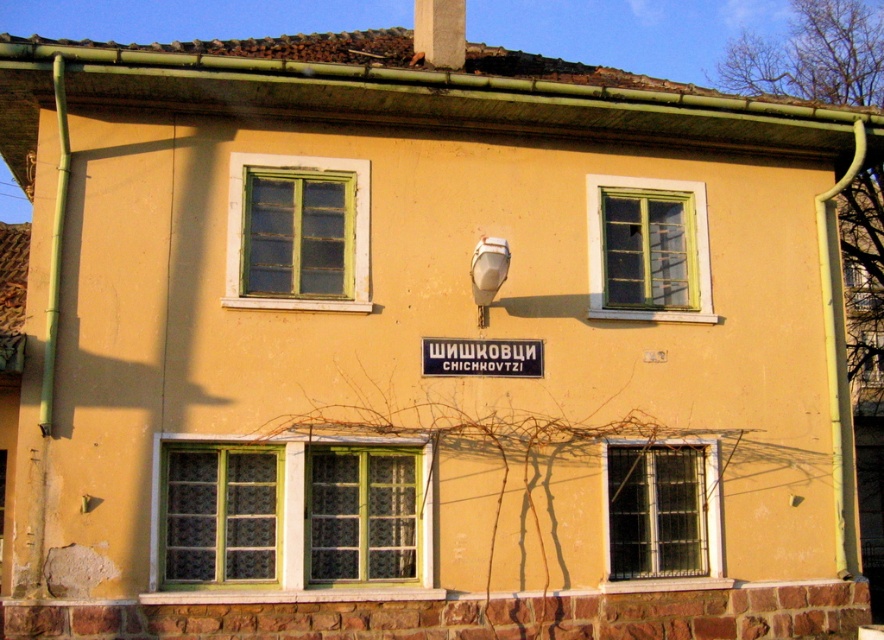
Is point (286, 541) less distant than point (707, 444)?

Yes, point (286, 541) is closer to viewer.

Identify the location of green textured glass window at lower center. (290, 518).

The height and width of the screenshot is (640, 884). What do you see at coordinates (290, 518) in the screenshot?
I see `green textured glass window at lower center` at bounding box center [290, 518].

Find the location of a particular element. The image size is (884, 640). green textured glass window at lower center is located at coordinates (290, 518).

Looking at this image, does clear glass window at center appear on the right side of black plastic sign at center?

Indeed, clear glass window at center is positioned on the right side of black plastic sign at center.

Who is more distant from viewer, (619,477) or (496,339)?

The point (619,477) is behind.

Between point (682, 508) and point (447, 352), which one is positioned in front?

Positioned in front is point (447, 352).

You are a GUI agent. You are given a task and a screenshot of the screen. Output one action in this format:
    pyautogui.click(x=<x>, y=<y>)
    Task: Click on the clear glass window at center
    This screenshot has height=640, width=884.
    Given the screenshot: What is the action you would take?
    pyautogui.click(x=663, y=509)

Who is positioned more to the left, green textured glass window at lower center or black plastic sign at center?

green textured glass window at lower center

Does green textured glass window at lower center appear over black plastic sign at center?

Actually, green textured glass window at lower center is below black plastic sign at center.

Who is more forward, (296, 449) or (425, 339)?

Point (296, 449) is more forward.

Locate an element on the screen. This screenshot has width=884, height=640. green textured glass window at lower center is located at coordinates pos(290,518).